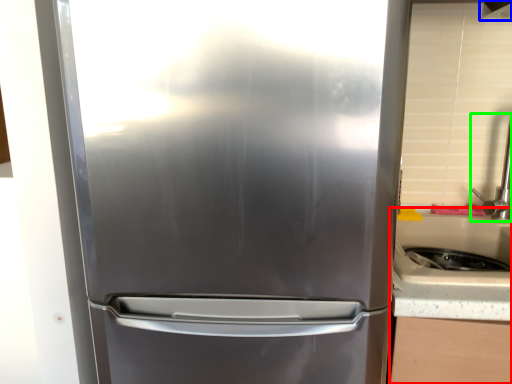
Question: Estimate the real-world distances between objects in this image. Which object is farther from counter top (highlighted by a red box), exhaust hood (highlighted by a blue box) or faucet (highlighted by a green box)?

Choices:
 (A) exhaust hood
 (B) faucet

Answer: (A)